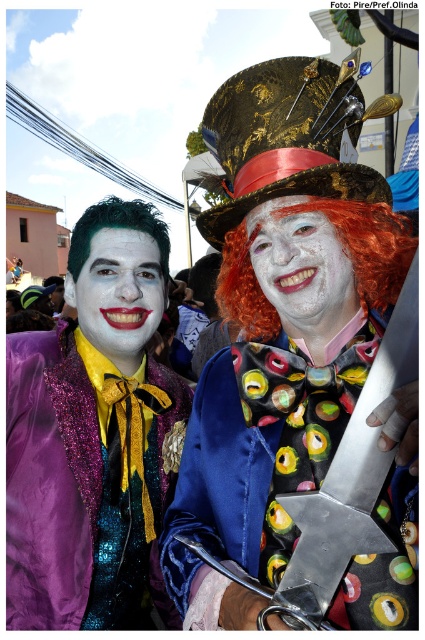
Question: Which object is positioned closest to the green shiny wig at left?

Choices:
 (A) matte black face at center
 (B) black satin bow tie at center
 (C) fluffy orange wig at center

Answer: (A)

Question: Does sparkly purple jacket at left appear under fluffy orange wig at center?

Choices:
 (A) no
 (B) yes

Answer: (B)

Question: Which point is closer to the camera?

Choices:
 (A) (170, 516)
 (B) (263, 278)
 (C) (76, 236)

Answer: (B)

Question: Does matte black face at center have a lesser width compared to green shiny wig at left?

Choices:
 (A) no
 (B) yes

Answer: (B)

Question: Which of the following is the closest to the observer?

Choices:
 (A) (79, 284)
 (B) (31, 387)

Answer: (B)

Question: Is sparkly purple jacket at left wider than matte black face at center?

Choices:
 (A) no
 (B) yes

Answer: (A)